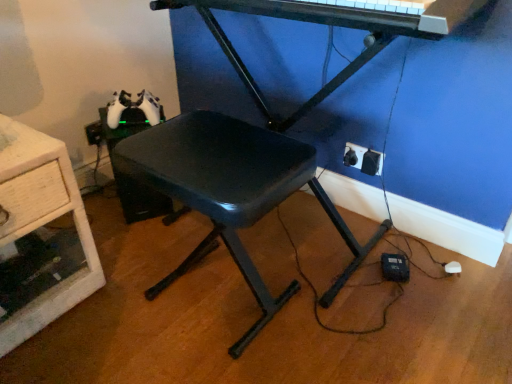
Identify the location of vacant point to the right of wooden drawer at left. (125, 288).